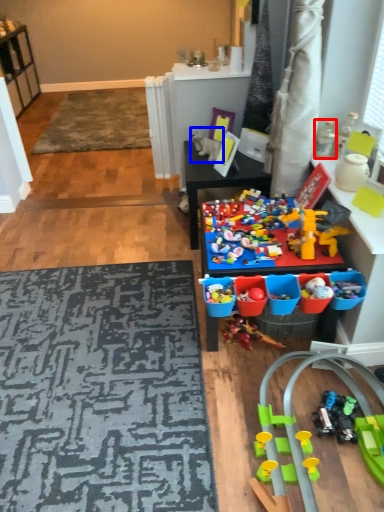
Question: Which object appears closest to the camera in this image, toy (highlighted by a red box) or toy (highlighted by a blue box)?

Choices:
 (A) toy
 (B) toy

Answer: (A)